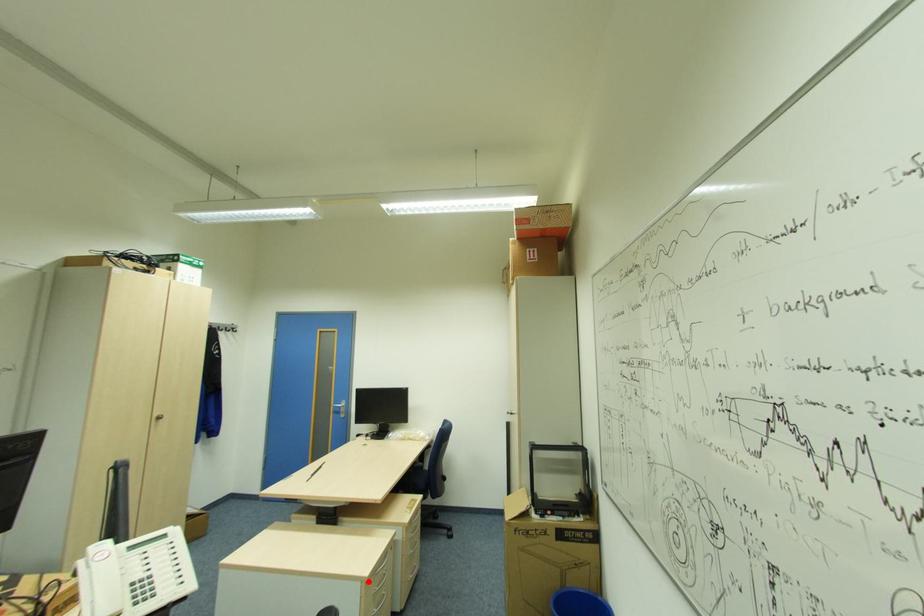
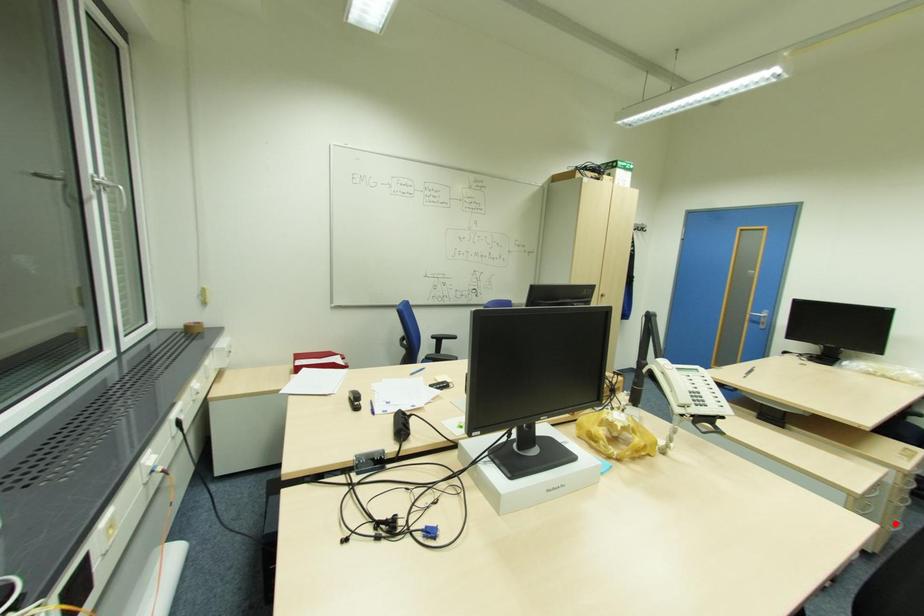
Based on the photo, I am providing you with two images of the same scene from different viewpoints. A red point is marked on the first image and another point is marked on the second image. Is the red point in image1 aligned with the point shown in image2?

No